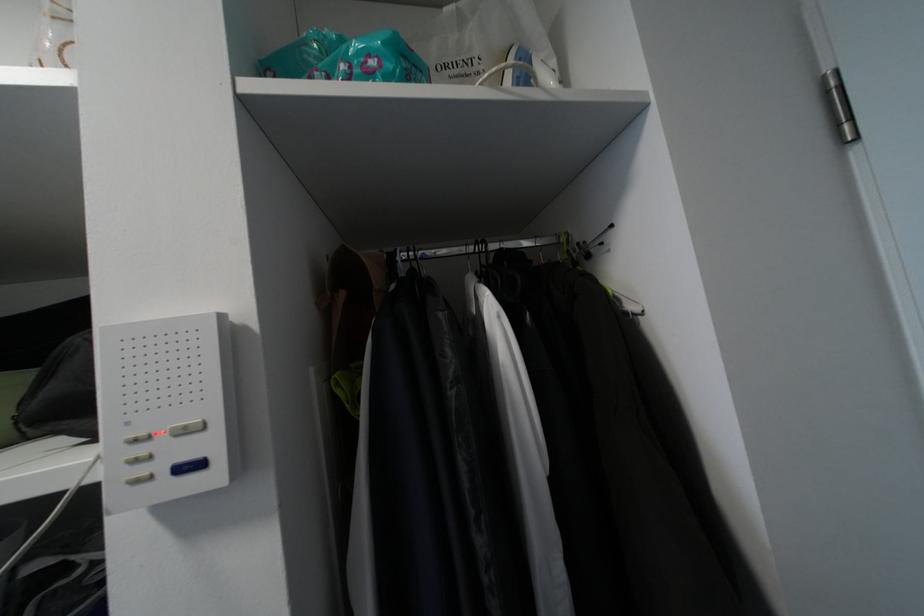
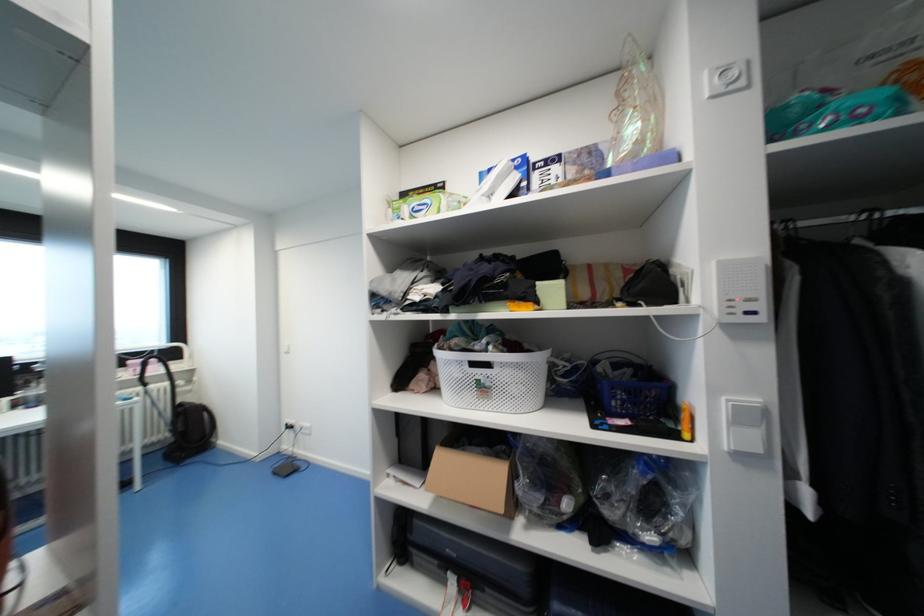
Where in the second image is the point corresponding to the point at 497,246 from the first image?

(895, 214)